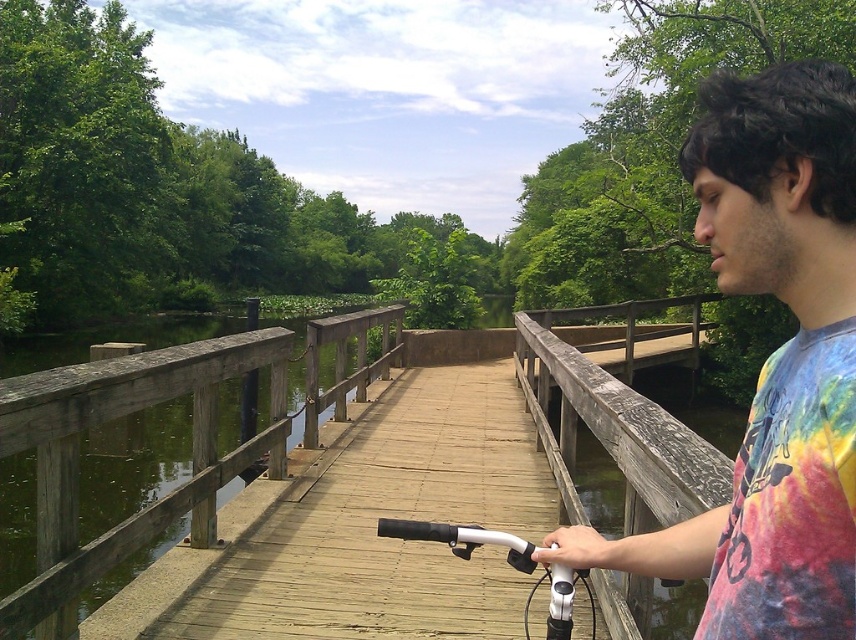
From the picture: Is green wood waterway at center below weathered wood rail at center?

Indeed, green wood waterway at center is positioned under weathered wood rail at center.

Between green wood waterway at center and weathered wood rail at center, which one appears on the right side from the viewer's perspective?

weathered wood rail at center is more to the right.

I want to click on green wood waterway at center, so click(x=108, y=422).

Can you confirm if tie-dye fabric shirt at center is thinner than white matte bicycle handlebars at center?

Correct, tie-dye fabric shirt at center's width is less than white matte bicycle handlebars at center's.

In the scene shown: Which is above, tie-dye fabric shirt at center or white matte bicycle handlebars at center?

tie-dye fabric shirt at center is above.

Does point (708, 193) come farther from viewer compared to point (397, 524)?

No, (708, 193) is in front of (397, 524).

The height and width of the screenshot is (640, 856). In order to click on tie-dye fabric shirt at center in this screenshot , I will do `click(771, 362)`.

Is green wood waterway at center below white matte bicycle handlebars at center?

Indeed, green wood waterway at center is positioned under white matte bicycle handlebars at center.

Between green wood waterway at center and white matte bicycle handlebars at center, which one has less height?

white matte bicycle handlebars at center

At what (x,y) coordinates should I click in order to perform the action: click on green wood waterway at center. Please return your answer as a coordinate pair (x, y). The image size is (856, 640). Looking at the image, I should click on (108, 422).